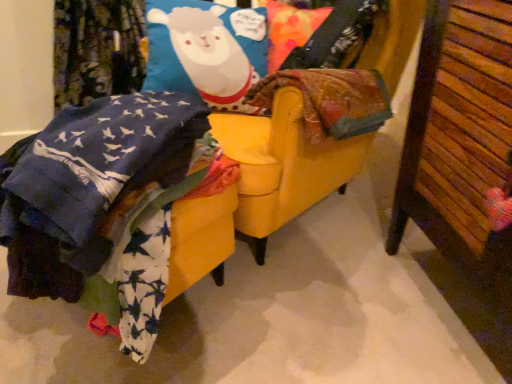
Question: From a real-world perspective, is yellow fabric swivel chair at center positioned under wooden slats at right based on gravity?

Choices:
 (A) no
 (B) yes

Answer: (B)

Question: Is yellow fabric swivel chair at center positioned far away from wooden slats at right?

Choices:
 (A) yes
 (B) no

Answer: (B)

Question: Can you confirm if yellow fabric swivel chair at center is positioned to the left of wooden slats at right?

Choices:
 (A) no
 (B) yes

Answer: (B)

Question: Does yellow fabric swivel chair at center have a lesser height compared to wooden slats at right?

Choices:
 (A) yes
 (B) no

Answer: (B)

Question: Would you say yellow fabric swivel chair at center contains wooden slats at right?

Choices:
 (A) yes
 (B) no

Answer: (B)

Question: Can you confirm if yellow fabric swivel chair at center is smaller than wooden slats at right?

Choices:
 (A) yes
 (B) no

Answer: (B)

Question: Is yellow fabric swivel chair at center inside wooden slats at right?

Choices:
 (A) no
 (B) yes

Answer: (A)

Question: Could you tell me if wooden slats at right is turned towards yellow fabric swivel chair at center?

Choices:
 (A) yes
 (B) no

Answer: (B)

Question: Is wooden slats at right completely or partially outside of yellow fabric swivel chair at center?

Choices:
 (A) no
 (B) yes

Answer: (B)

Question: From a real-world perspective, is wooden slats at right beneath yellow fabric swivel chair at center?

Choices:
 (A) yes
 (B) no

Answer: (B)

Question: Is wooden slats at right closer to the viewer compared to yellow fabric swivel chair at center?

Choices:
 (A) yes
 (B) no

Answer: (A)

Question: From the image's perspective, would you say wooden slats at right is shown under yellow fabric swivel chair at center?

Choices:
 (A) yes
 (B) no

Answer: (A)

Question: Is yellow fabric swivel chair at center wider or thinner than wooden slats at right?

Choices:
 (A) wide
 (B) thin

Answer: (A)